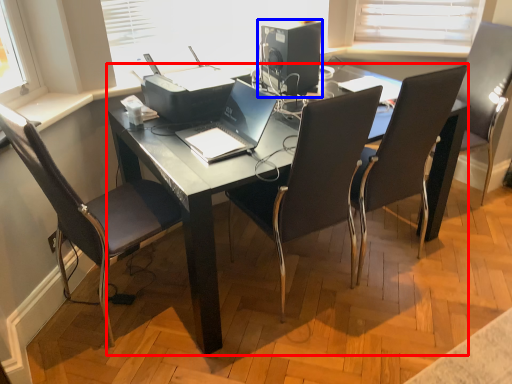
Question: Which point is closer to the camera, desk (highlighted by a red box) or desktop computer (highlighted by a blue box)?

Choices:
 (A) desk
 (B) desktop computer

Answer: (A)